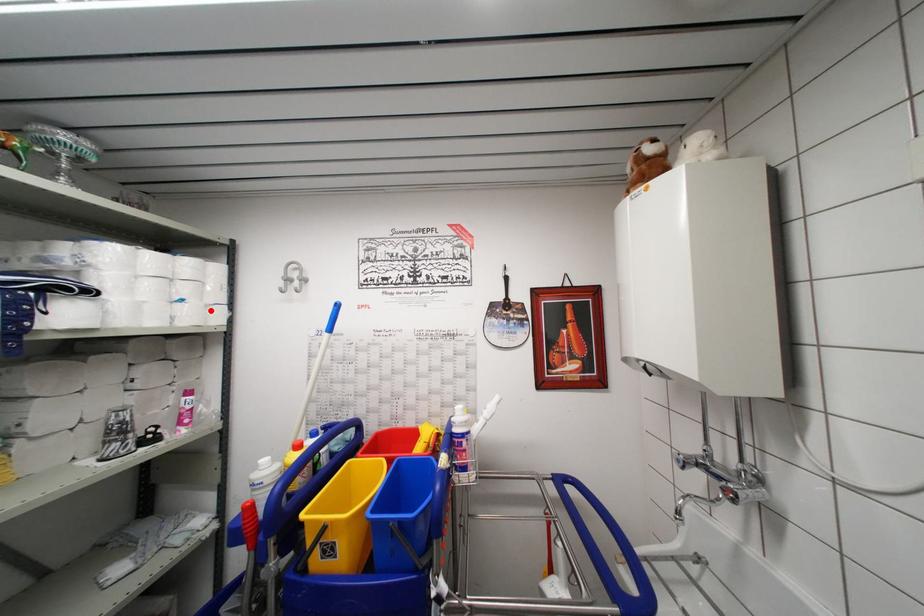
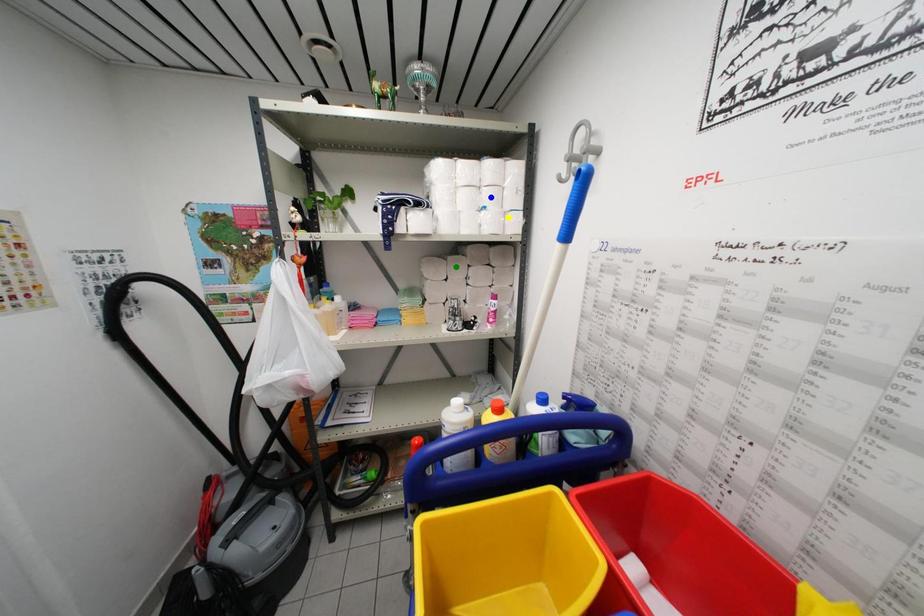
Question: I am providing you with two images of the same scene from different viewpoints. A red point is marked on the first image. You are given multiple points on the second image. Which point in image 2 is actually the same real-world point as the red point in image 1?

Choices:
 (A) blue point
 (B) green point
 (C) yellow point

Answer: (C)